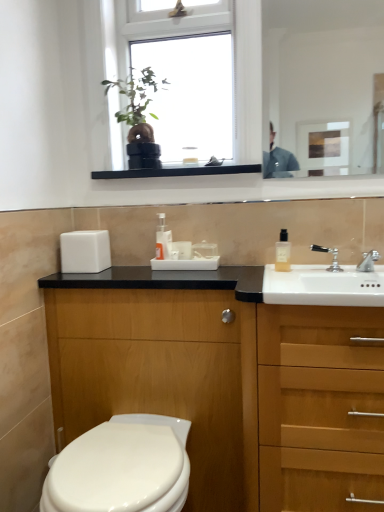
Image resolution: width=384 pixels, height=512 pixels. In order to click on vacant region to the right of clear glass bottle at upper right, acting as the first toiletry starting from the right in this screenshot , I will do tap(314, 267).